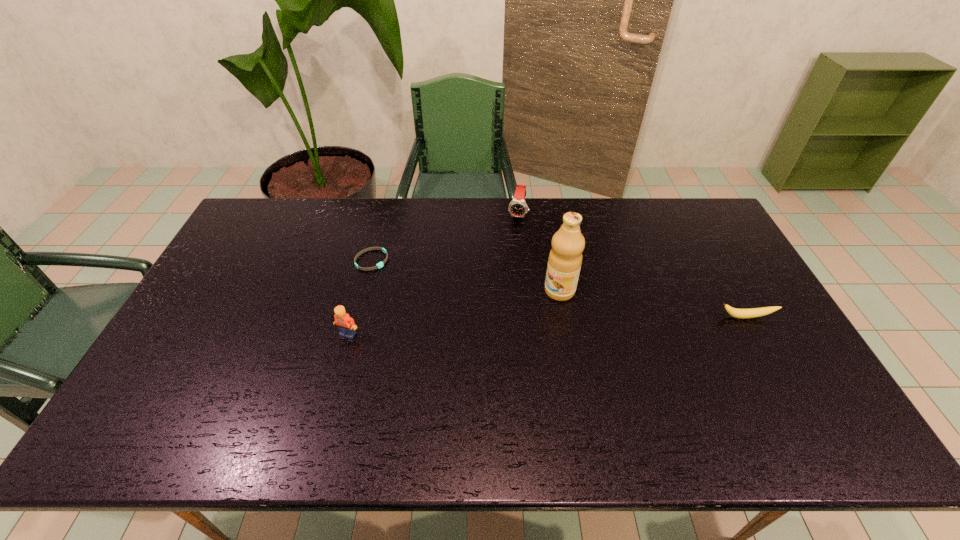
Identify the location of vacant space on the desktop that is between the nearest object and the rightmost object and is positioned on the label of the tallest object. (504, 327).

I want to click on free space on the desktop that is between the Lego and the banana and is positioned on the face of the watch, so click(491, 328).

Find the location of `free space on the desktop that is between the Lego and the fourth tallest object and is positioned on the buckle of the shortest object`. free space on the desktop that is between the Lego and the fourth tallest object and is positioned on the buckle of the shortest object is located at coordinates (492, 328).